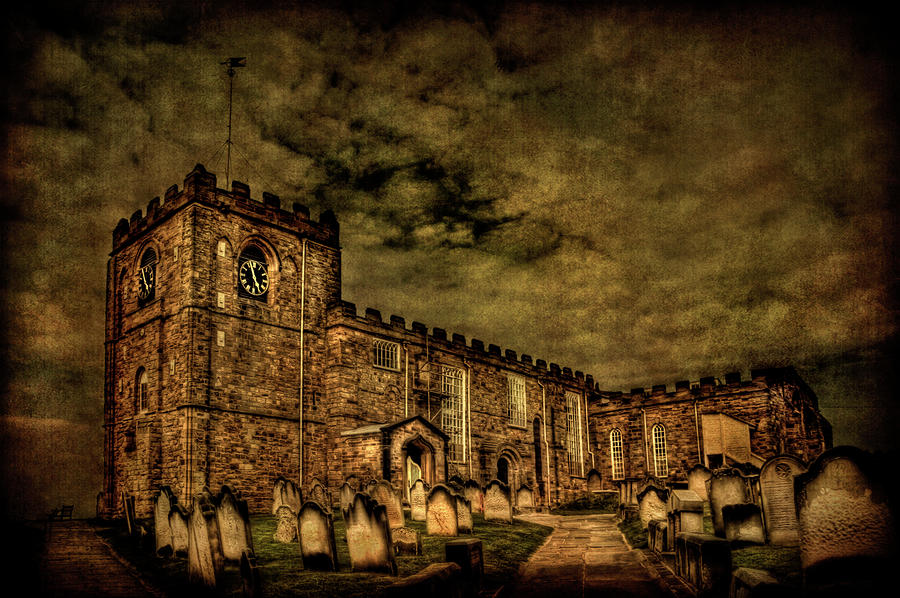
Find the location of a particular element. The width and height of the screenshot is (900, 598). windows is located at coordinates (383, 352), (144, 390), (452, 411), (515, 402), (579, 443), (618, 460), (659, 451).